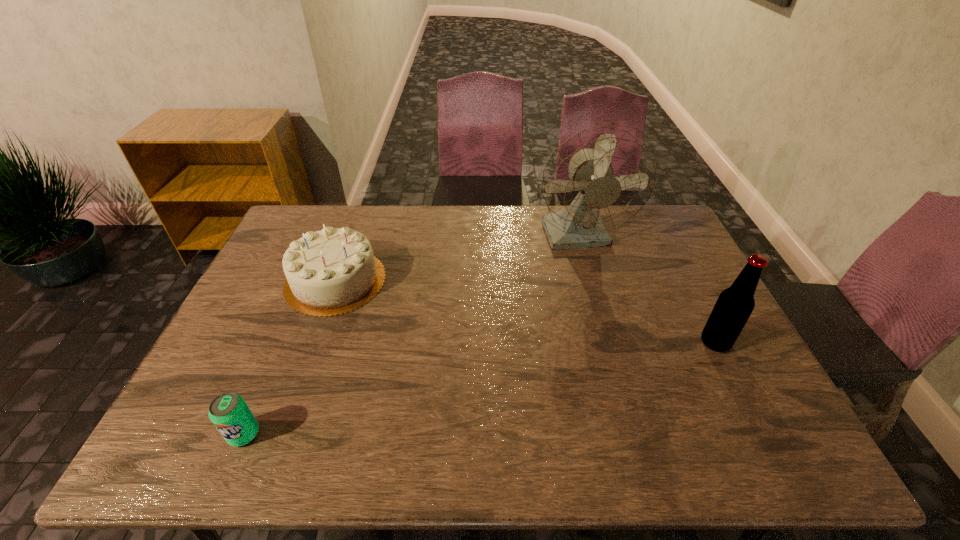
Where is `object located at the far edge`? object located at the far edge is located at coordinates (600, 178).

What are the coordinates of `object positioned at the near edge` in the screenshot? It's located at click(x=229, y=413).

The width and height of the screenshot is (960, 540). Find the location of `birthday cake that is at the left edge`. birthday cake that is at the left edge is located at coordinates (x=333, y=271).

Identify the location of pop soda present at the left edge. The image size is (960, 540). (229, 413).

Find the location of `object that is at the right edge`. object that is at the right edge is located at coordinates (735, 304).

The height and width of the screenshot is (540, 960). Identify the location of object that is at the near left corner. (229, 413).

In the image, there is a desktop. Identify the location of free space at the far edge. Image resolution: width=960 pixels, height=540 pixels. (364, 220).

At what (x,y) coordinates should I click in order to perform the action: click on free space at the left edge of the desktop. Please return your answer as a coordinate pair (x, y). This screenshot has width=960, height=540. Looking at the image, I should click on (259, 329).

Find the location of `vacant area at the right edge of the desktop`. vacant area at the right edge of the desktop is located at coordinates (763, 410).

The height and width of the screenshot is (540, 960). In the image, there is a desktop. Identify the location of vacant area at the far right corner. (660, 231).